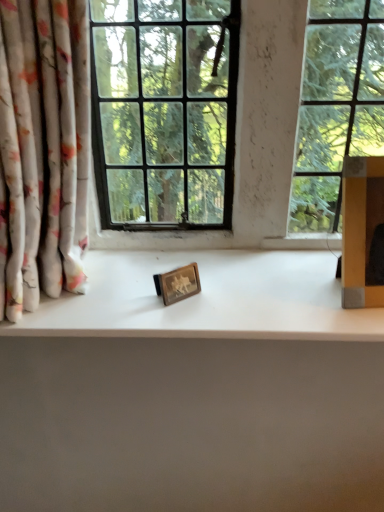
This screenshot has width=384, height=512. Identify the location of free spot to the right of floral fabric curtain at left. (180, 301).